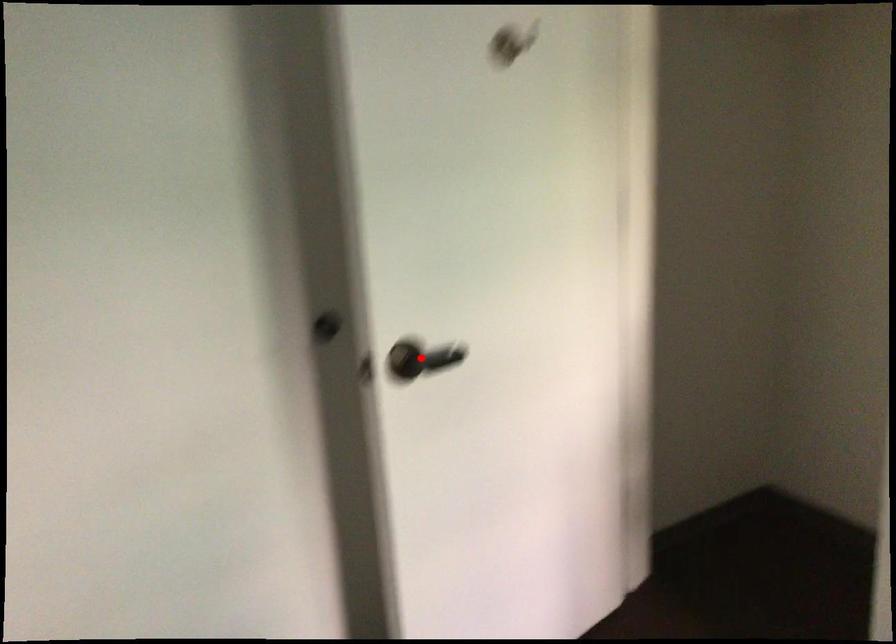
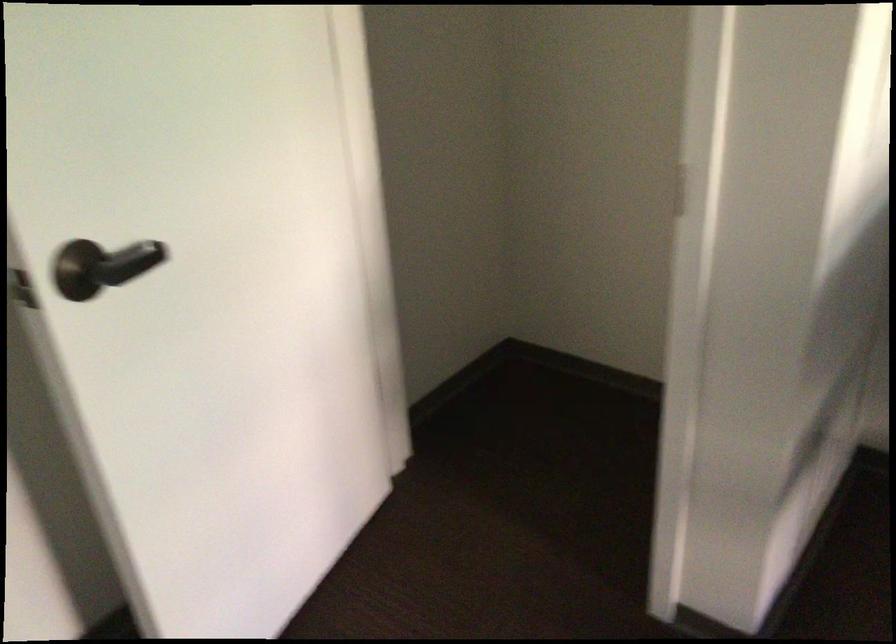
Question: A red point is marked in image1. In image2, is the corresponding 3D point closer to the camera or farther? Reply with the corresponding letter.

Choices:
 (A) The corresponding 3D point is closer.
 (B) The corresponding 3D point is farther.

Answer: (A)